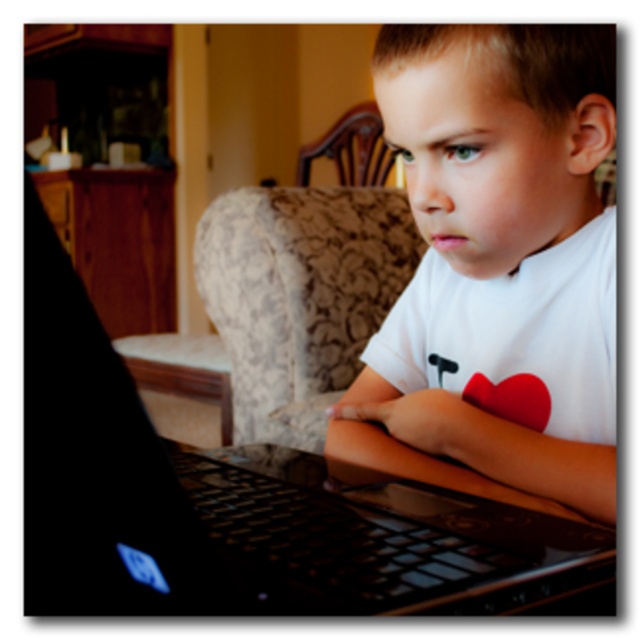
You are a furniture designer evaluating the spatial arrangement of a room. You notice the wooden chair at upper center and the red matte heart at lower center. Which object has a greater width?

The wooden chair at upper center has a greater width than the red matte heart at lower center.

You are a photographer trying to capture a clear shot of the black glossy laptop at center and the wooden chair at upper center. Since the laptop is slightly angled away from you, you want to adjust your position to get a better view. Which direction should you move to ensure both objects are in frame and the laptop is no longer facing away?

Move to the right side of the setup so that the black glossy laptop at center is no longer facing away and both it and the wooden chair at upper center remain in frame.

You are a delivery robot with a package that needs to be placed between the black glossy laptop at center and the red matte heart at lower center. The package measures 40 centimeters in length. Will the package fit in the space between them?

The black glossy laptop at center is 39.30 centimeters away from the red matte heart at lower center. Since the package is 40 centimeters long, it will not fit in the space between them as the distance is slightly shorter than the package length.